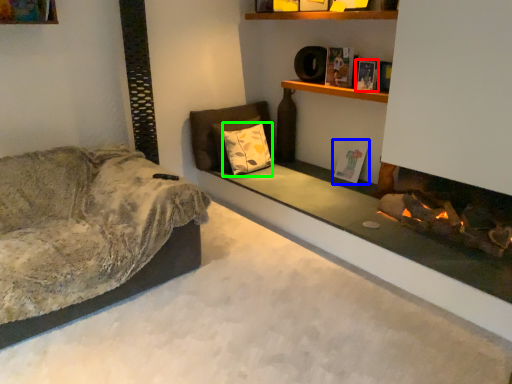
Question: Estimate the real-world distances between objects in this image. Which object is farther from book (highlighted by a red box), book (highlighted by a blue box) or pillow (highlighted by a green box)?

Choices:
 (A) book
 (B) pillow

Answer: (B)